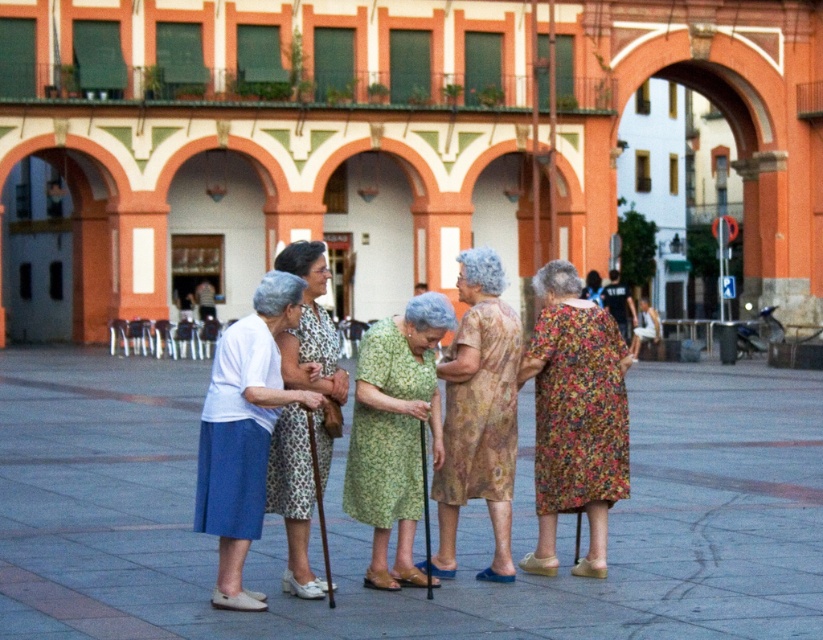
Based on the scene description, which dress is positioned lower between the green floral dress at center and the printed fabric dress at center?

The green floral dress at center is below the printed fabric dress at center, so it is positioned lower.

You are a fashion designer observing the two dresses in the image. The green floral dress at center and the printed fabric dress at center. Which dress is shorter?

The green floral dress at center is shorter than the printed fabric dress at center.